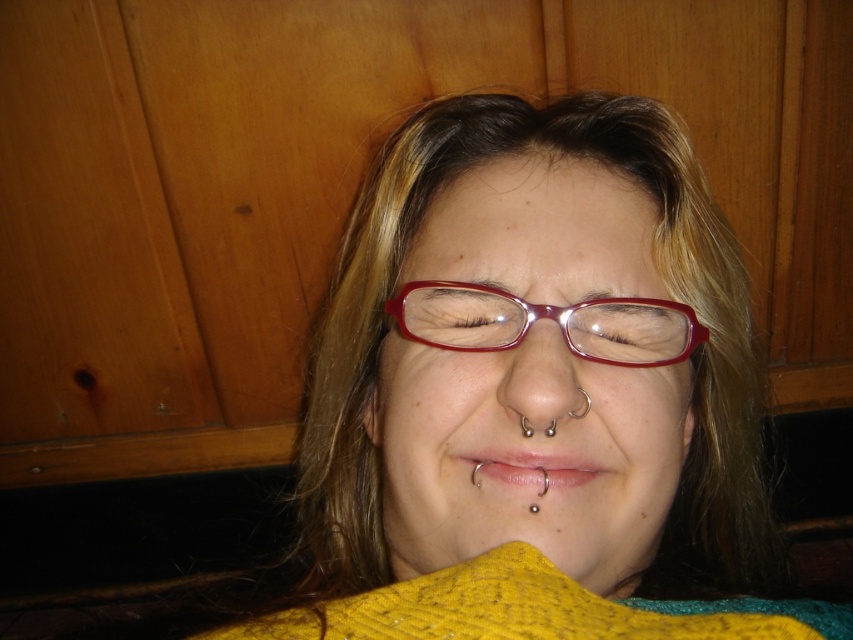
Between point (549, 609) and point (555, 472), which one is positioned behind?

Positioned behind is point (555, 472).

What do you see at coordinates (529, 384) in the screenshot? The width and height of the screenshot is (853, 640). I see `matte yellow sweater at center` at bounding box center [529, 384].

Find the location of a particular element. This screenshot has height=640, width=853. matte yellow sweater at center is located at coordinates (529, 384).